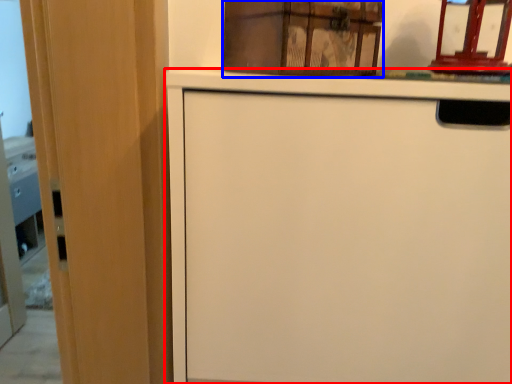
Question: Which object appears closest to the camera in this image, cabinetry (highlighted by a red box) or cabinetry (highlighted by a blue box)?

Choices:
 (A) cabinetry
 (B) cabinetry

Answer: (A)